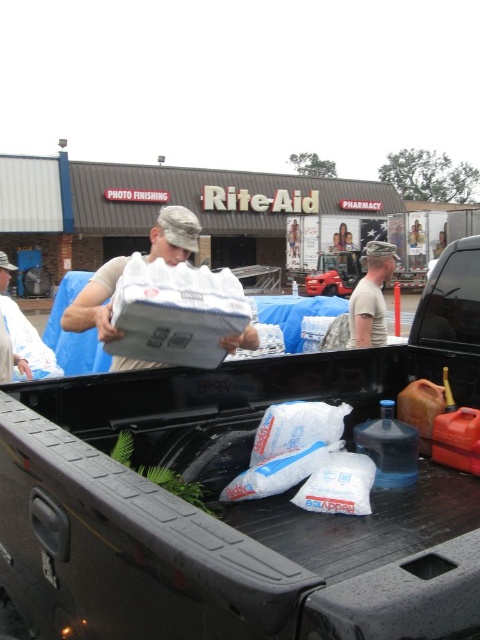
Which is in front, point (324, 572) or point (386, 252)?

Point (324, 572) is more forward.

Between black rubber truck bed at center and camouflage uniform at center, which one appears on the left side from the viewer's perspective?

black rubber truck bed at center is more to the left.

Between point (433, 467) and point (372, 337), which one is positioned behind?

Positioned behind is point (372, 337).

Find the location of a particular element. black rubber truck bed at center is located at coordinates (238, 502).

Is white plastic bag at center to the left of camouflage uniform at center from the viewer's perspective?

Indeed, white plastic bag at center is positioned on the left side of camouflage uniform at center.

Which is more to the right, white plastic bag at center or camouflage uniform at center?

Positioned to the right is camouflage uniform at center.

At what (x,y) coordinates should I click in order to perform the action: click on white plastic bag at center. Please return your answer as a coordinate pair (x, y). Image resolution: width=480 pixels, height=640 pixels. Looking at the image, I should click on (20, 337).

Where is `white plastic bag at center`? The image size is (480, 640). white plastic bag at center is located at coordinates (20, 337).

Can you confirm if black rubber truck bed at center is bigger than white plastic bag at center?

Correct, black rubber truck bed at center is larger in size than white plastic bag at center.

Can you confirm if black rubber truck bed at center is wider than white plastic bag at center?

Yes.

Measure the distance between black rubber truck bed at center and camera.

black rubber truck bed at center and camera are 27.41 inches apart from each other.

Find the location of a particular element. black rubber truck bed at center is located at coordinates (238, 502).